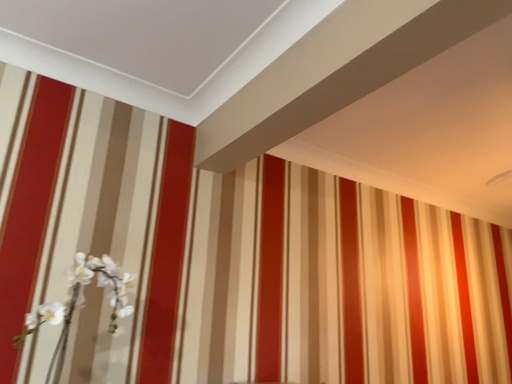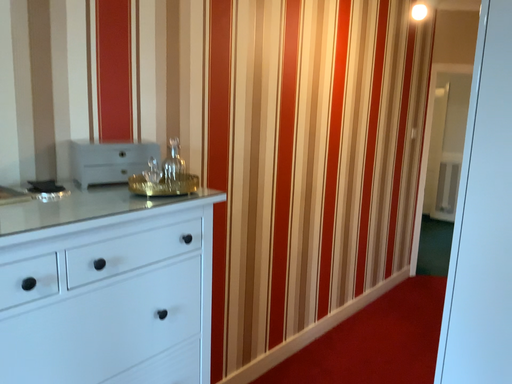
Question: Which way did the camera rotate in the video?

Choices:
 (A) rotated upward
 (B) rotated downward

Answer: (B)